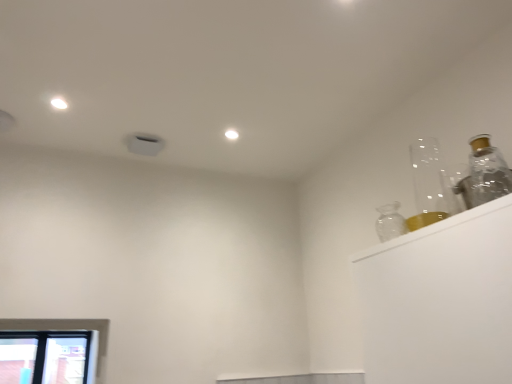
Question: Does point (100, 344) appear closer or farther from the camera than point (503, 162)?

Choices:
 (A) closer
 (B) farther

Answer: (B)

Question: From a real-world perspective, is clear glass window at lower left above or below transparent glass bottle at upper right?

Choices:
 (A) below
 (B) above

Answer: (A)

Question: Considering the positions of clear glass window at lower left and transparent glass bottle at upper right in the image, is clear glass window at lower left wider or thinner than transparent glass bottle at upper right?

Choices:
 (A) thin
 (B) wide

Answer: (B)

Question: From the image's perspective, is transparent glass bottle at upper right positioned above or below clear glass window at lower left?

Choices:
 (A) below
 (B) above

Answer: (B)

Question: Considering the positions of point (478, 180) and point (3, 327), is point (478, 180) closer or farther from the camera than point (3, 327)?

Choices:
 (A) closer
 (B) farther

Answer: (A)

Question: From a real-world perspective, is transparent glass bottle at upper right physically located above or below clear glass window at lower left?

Choices:
 (A) above
 (B) below

Answer: (A)

Question: Visually, is transparent glass bottle at upper right positioned to the left or to the right of clear glass window at lower left?

Choices:
 (A) right
 (B) left

Answer: (A)